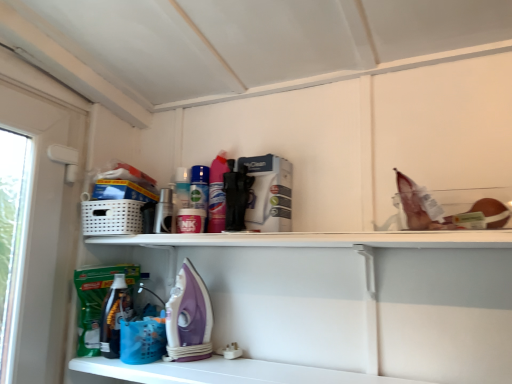
Where is `vacant area that is in front of purple plastic iron at lower center`? This screenshot has width=512, height=384. vacant area that is in front of purple plastic iron at lower center is located at coordinates (176, 368).